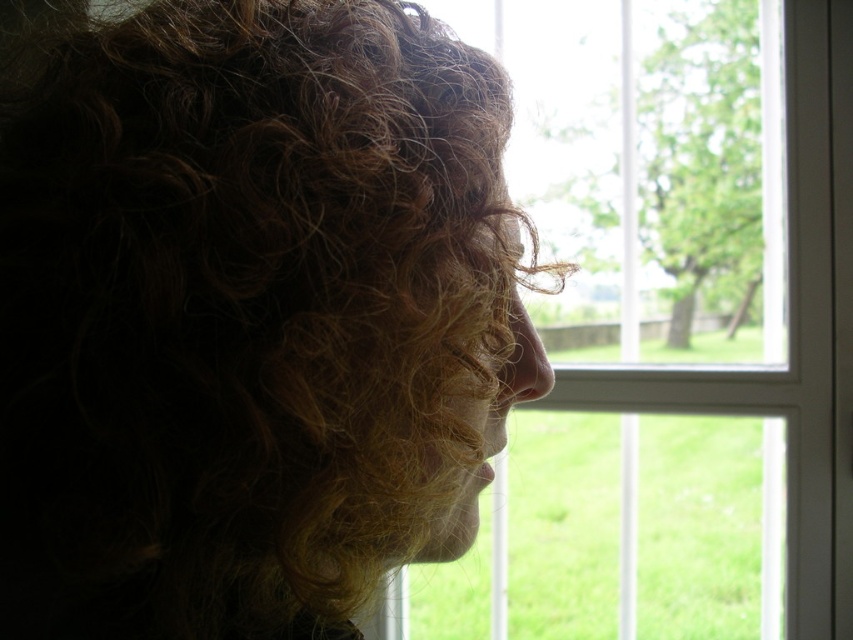
Question: Is curly golden hair at right below clear glass window at center?

Choices:
 (A) yes
 (B) no

Answer: (A)

Question: Which point is farther from the camera taking this photo?

Choices:
 (A) (287, 236)
 (B) (839, 417)

Answer: (B)

Question: Is curly golden hair at right to the left of clear glass window at center from the viewer's perspective?

Choices:
 (A) no
 (B) yes

Answer: (B)

Question: Which object appears closest to the camera in this image?

Choices:
 (A) clear glass window at center
 (B) curly golden hair at right

Answer: (B)

Question: Is curly golden hair at right above clear glass window at center?

Choices:
 (A) no
 (B) yes

Answer: (A)